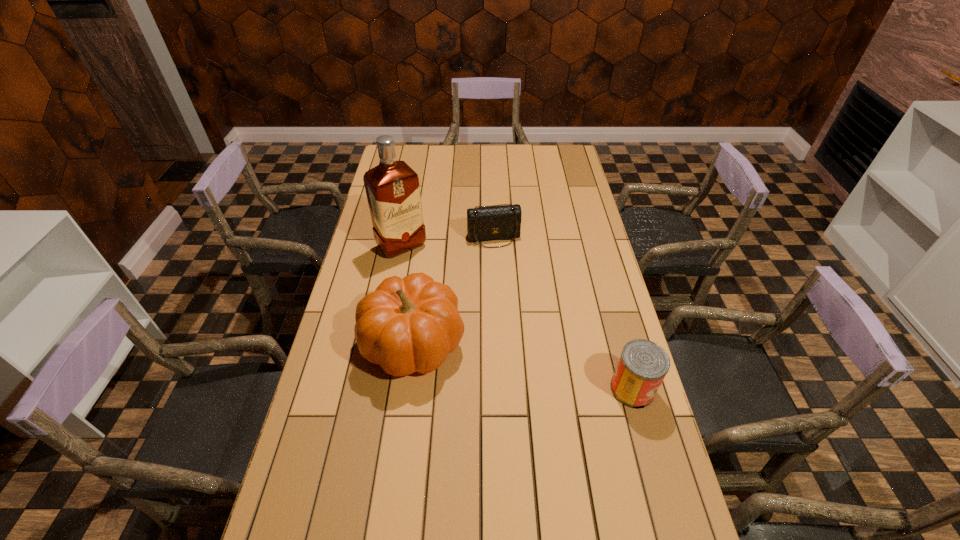
The height and width of the screenshot is (540, 960). Find the location of `object that is the closest one to the can`. object that is the closest one to the can is located at coordinates (410, 324).

At what (x,y) coordinates should I click in order to perform the action: click on free space that satisfies the following two spatial constraints: 1. on the front side of the third shortest object; 2. on the left side of the can. Please return your answer as a coordinate pair (x, y). The height and width of the screenshot is (540, 960). Looking at the image, I should click on (407, 389).

Where is `free spot that satisfies the following two spatial constraints: 1. on the front side of the rightmost object; 2. on the left side of the liquor`? free spot that satisfies the following two spatial constraints: 1. on the front side of the rightmost object; 2. on the left side of the liquor is located at coordinates coord(374,389).